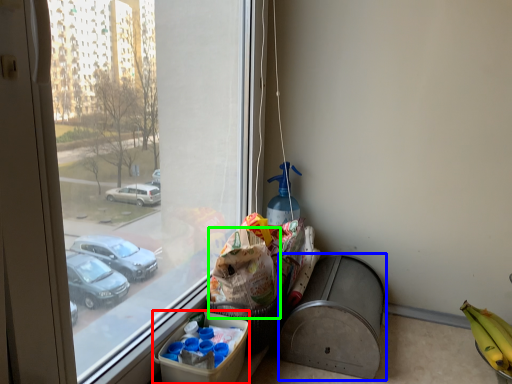
Question: Which object is the farthest from cardboard box (highlighted by a red box)? Choose among these: recycling bin (highlighted by a blue box) or grocery bag (highlighted by a green box).

Choices:
 (A) recycling bin
 (B) grocery bag

Answer: (A)